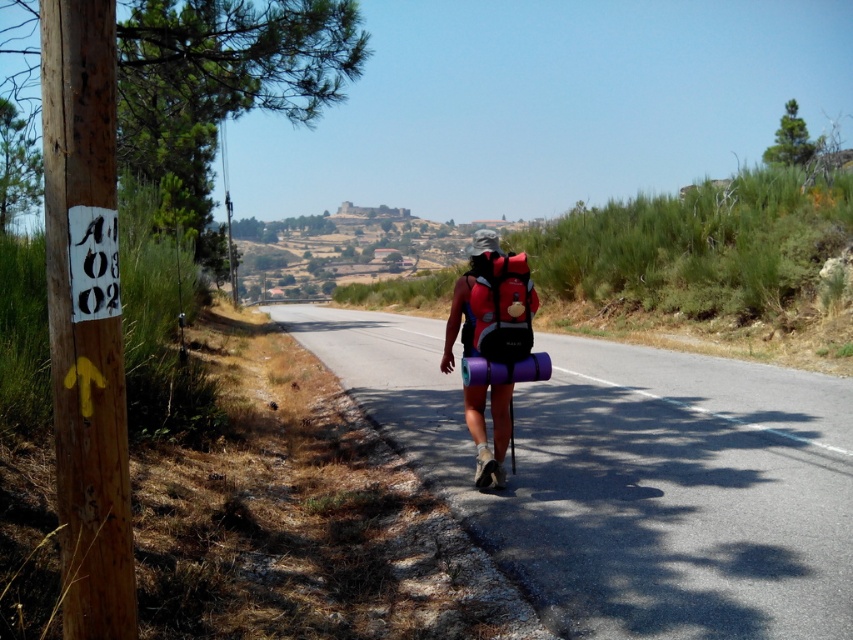
You are a hiker who wants to ensure your backpacks fit through a narrow trail. You have a purple fabric backpack at center and a matte red backpack at center. Which backpack might have a harder time fitting through a narrow path?

The purple fabric backpack at center might have a harder time fitting through a narrow path since it is wider than the matte red backpack at center according to the description.

You are a hiker who just noticed two backpacks at the center of the road. Which backpack is closer to you, the purple fabric backpack at center or the matte red backpack at center?

The purple fabric backpack at center is closer to you because the matte red backpack at center is behind it.

You are a hiker trying to decide which backpack to take for your trip. You see the purple fabric backpack at center and the matte red backpack at center. Which one has more vertical space for packing taller items?

The purple fabric backpack at center is taller than the matte red backpack at center, so it has more vertical space for packing taller items.